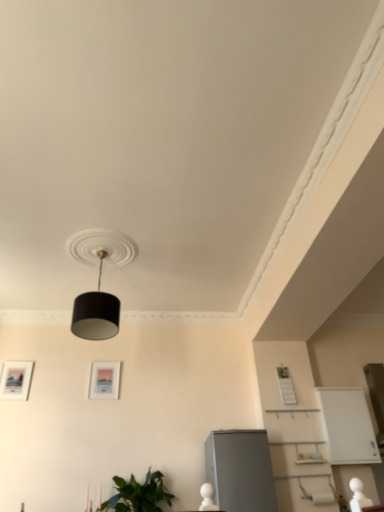
Locate an element on the screen. The width and height of the screenshot is (384, 512). green leafy plant at lower left is located at coordinates (138, 494).

Find the location of a particular element. The image size is (384, 512). white glossy cabinet at lower right is located at coordinates (347, 426).

Locate an element on the screen. white matte picture frame at upper right, positioned as the 1th picture frame in right-to-left order is located at coordinates (286, 386).

Image resolution: width=384 pixels, height=512 pixels. I want to click on matte white picture frame at center, the second picture frame positioned from the right, so click(x=104, y=380).

Locate an element on the screen. matte black picture frame at left, which appears as the 3th picture frame when viewed from the right is located at coordinates (16, 379).

Is black matte lampshade at center spatially inside matte white picture frame at center, the second picture frame positioned from the right, or outside of it?

black matte lampshade at center is not inside matte white picture frame at center, the second picture frame positioned from the right, it's outside.

Are black matte lampshade at center and matte white picture frame at center, the second picture frame positioned from the right, beside each other?

No, black matte lampshade at center is not touching matte white picture frame at center, the second picture frame positioned from the right.

Considering their positions, is black matte lampshade at center located in front of or behind matte white picture frame at center, the second picture frame positioned from the right?

Visually, black matte lampshade at center is located in front of matte white picture frame at center, the second picture frame positioned from the right.

From a real-world perspective, who is located higher, matte black picture frame at left, which appears as the 3th picture frame when viewed from the right, or black matte lampshade at center?

black matte lampshade at center is physically above.

Does matte black picture frame at left, which is counted as the 1th picture frame, starting from the left, appear on the right side of black matte lampshade at center?

Incorrect, matte black picture frame at left, which is counted as the 1th picture frame, starting from the left, is not on the right side of black matte lampshade at center.

Which is behind, point (11, 373) or point (109, 295)?

The point (11, 373) is farther from the camera.

Is white glossy cabinet at lower right further to camera compared to black matte lampshade at center?

Yes, white glossy cabinet at lower right is behind black matte lampshade at center.

Is point (334, 451) in front of point (87, 312)?

That is False.

Is white glossy cabinet at lower right facing away from black matte lampshade at center?

white glossy cabinet at lower right is not turned away from black matte lampshade at center.

Considering the relative positions of white glossy cabinet at lower right and matte black picture frame at left, which appears as the 3th picture frame when viewed from the right, in the image provided, is white glossy cabinet at lower right behind matte black picture frame at left, which appears as the 3th picture frame when viewed from the right,?

No.

Which is more distant, (x=372, y=429) or (x=10, y=380)?

The point (x=10, y=380) is more distant.

Consider the image. Is white glossy cabinet at lower right touching matte black picture frame at left, which is counted as the 1th picture frame, starting from the left?

No.

Consider the image. Can matte black picture frame at left, which is counted as the 1th picture frame, starting from the left, be found inside white glossy cabinet at lower right?

No, white glossy cabinet at lower right does not contain matte black picture frame at left, which is counted as the 1th picture frame, starting from the left.

Between black matte lampshade at center and satin grey refrigerator at lower right, which one has smaller size?

black matte lampshade at center.

Which is closer, (100, 339) or (247, 430)?

Clearly, point (100, 339) is closer to the camera than point (247, 430).

How much distance is there between black matte lampshade at center and satin grey refrigerator at lower right?

A distance of 1.69 meters exists between black matte lampshade at center and satin grey refrigerator at lower right.

From the image's perspective, which one is positioned lower, black matte lampshade at center or satin grey refrigerator at lower right?

satin grey refrigerator at lower right is shown below in the image.

Considering the relative sizes of white glossy cabinet at lower right and white matte picture frame at upper right, which is counted as the third picture frame, starting from the left, in the image provided, is white glossy cabinet at lower right wider than white matte picture frame at upper right, which is counted as the third picture frame, starting from the left,?

Yes.

Can you confirm if white glossy cabinet at lower right is taller than white matte picture frame at upper right, positioned as the 1th picture frame in right-to-left order?

Indeed, white glossy cabinet at lower right has a greater height compared to white matte picture frame at upper right, positioned as the 1th picture frame in right-to-left order.

From a real-world perspective, is white glossy cabinet at lower right over white matte picture frame at upper right, which is counted as the third picture frame, starting from the left?

No, from a real-world perspective, white glossy cabinet at lower right is not over white matte picture frame at upper right, which is counted as the third picture frame, starting from the left

In the scene shown: Which is behind, white glossy cabinet at lower right or white matte picture frame at upper right, which is counted as the third picture frame, starting from the left?

white matte picture frame at upper right, which is counted as the third picture frame, starting from the left, is more distant.

Could you tell me if green leafy plant at lower left is turned towards black matte lampshade at center?

No, green leafy plant at lower left does not turn towards black matte lampshade at center.

From a real-world perspective, which object stands above the other?

black matte lampshade at center, from a real-world perspective.

From the image's perspective, which is above, green leafy plant at lower left or black matte lampshade at center?

black matte lampshade at center, from the image's perspective.

Locate an element on the screen. This screenshot has width=384, height=512. lamp above the matte white picture frame at center, placed as the second picture frame when sorted from left to right (from a real-world perspective) is located at coordinates (96, 312).

The height and width of the screenshot is (512, 384). I want to click on lamp in front of the matte black picture frame at left, which is counted as the 1th picture frame, starting from the left, so click(x=96, y=312).

Based on their spatial positions, is black matte lampshade at center or matte black picture frame at left, which is counted as the 1th picture frame, starting from the left, further from white glossy cabinet at lower right?

matte black picture frame at left, which is counted as the 1th picture frame, starting from the left, lies further to white glossy cabinet at lower right than the other object.

Based on the photo, estimate the real-world distances between objects in this image. Which object is further from white glossy cabinet at lower right, matte white picture frame at center, placed as the second picture frame when sorted from left to right, or matte black picture frame at left, which appears as the 3th picture frame when viewed from the right?

matte black picture frame at left, which appears as the 3th picture frame when viewed from the right.

In the scene shown: Considering their positions, is green leafy plant at lower left positioned closer to satin grey refrigerator at lower right than matte black picture frame at left, which is counted as the 1th picture frame, starting from the left?

The object closer to satin grey refrigerator at lower right is green leafy plant at lower left.

Estimate the real-world distances between objects in this image. Which object is further from green leafy plant at lower left, satin grey refrigerator at lower right or white glossy cabinet at lower right?

The object further to green leafy plant at lower left is white glossy cabinet at lower right.

Based on their spatial positions, is white matte picture frame at upper right, which is counted as the third picture frame, starting from the left, or satin grey refrigerator at lower right closer to white glossy cabinet at lower right?

Based on the image, white matte picture frame at upper right, which is counted as the third picture frame, starting from the left, appears to be nearer to white glossy cabinet at lower right.

Based on their spatial positions, is black matte lampshade at center or matte black picture frame at left, which appears as the 3th picture frame when viewed from the right, closer to white matte picture frame at upper right, positioned as the 1th picture frame in right-to-left order?

black matte lampshade at center.

Considering their positions, is green leafy plant at lower left positioned further to white glossy cabinet at lower right than satin grey refrigerator at lower right?

green leafy plant at lower left lies further to white glossy cabinet at lower right than the other object.

When comparing their distances from green leafy plant at lower left, does matte white picture frame at center, the second picture frame positioned from the right, or matte black picture frame at left, which is counted as the 1th picture frame, starting from the left, seem further?

Based on the image, matte black picture frame at left, which is counted as the 1th picture frame, starting from the left, appears to be further to green leafy plant at lower left.

You are a GUI agent. You are given a task and a screenshot of the screen. Output one action in this format:
    pyautogui.click(x=<x>, y=<y>)
    Task: Click on the houseplant situated between matte black picture frame at left, which appears as the 3th picture frame when viewed from the right, and satin grey refrigerator at lower right from left to right
    Image resolution: width=384 pixels, height=512 pixels.
    Given the screenshot: What is the action you would take?
    pyautogui.click(x=138, y=494)

Locate an element on the screen. The width and height of the screenshot is (384, 512). picture frame situated between black matte lampshade at center and white glossy cabinet at lower right from left to right is located at coordinates (286, 386).

At what (x,y) coordinates should I click in order to perform the action: click on appliance between matte black picture frame at left, which is counted as the 1th picture frame, starting from the left, and white glossy cabinet at lower right from left to right. Please return your answer as a coordinate pair (x, y). This screenshot has width=384, height=512. Looking at the image, I should click on (240, 470).

At what (x,y) coordinates should I click in order to perform the action: click on appliance situated between matte white picture frame at center, placed as the second picture frame when sorted from left to right, and white glossy cabinet at lower right from left to right. Please return your answer as a coordinate pair (x, y). This screenshot has width=384, height=512. Looking at the image, I should click on (240, 470).